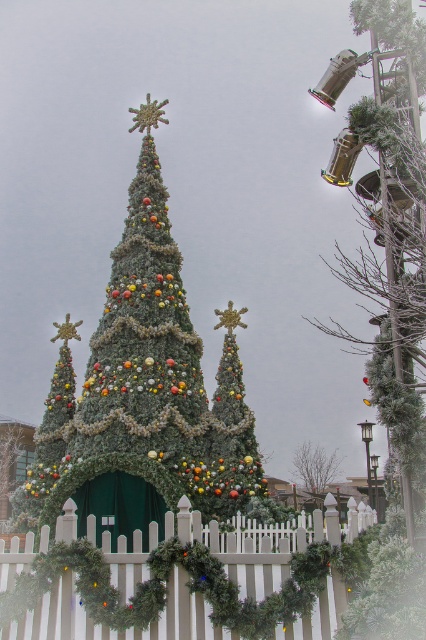
You are planning to place a new decoration on the larger of the two items in the scene. Which item should you choose between the green textured christmas tree at center and the frosted greenery at upper right?

The green textured christmas tree at center is bigger than the frosted greenery at upper right, so you should choose the green textured christmas tree at center to place the new decoration.

You are standing in front of the festive outdoor scene. You see the white picket fence at center and the green matte christmas tree at center. Which object is positioned lower in the image?

The white picket fence at center is located below the green matte christmas tree at center, so it is positioned lower in the image.